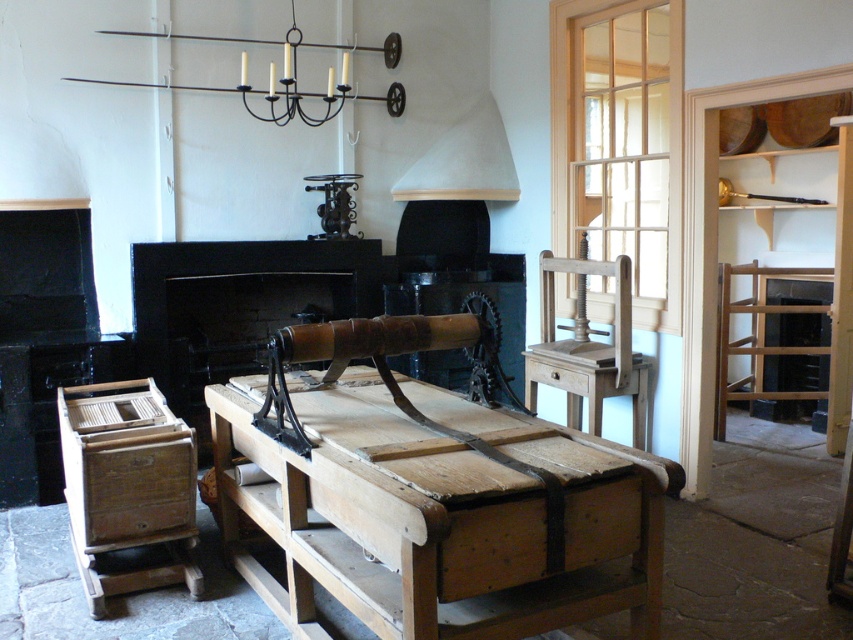
Between point (256, 253) and point (393, 58), which one is positioned in front?

Point (256, 253) is more forward.

Does black matte fireplace at center have a larger size compared to black metal chandelier at upper center?

Indeed, black matte fireplace at center has a larger size compared to black metal chandelier at upper center.

Between point (142, 348) and point (172, 88), which one is positioned in front?

Point (142, 348)

Find the location of a particular element. black matte fireplace at center is located at coordinates (236, 307).

Can you confirm if wooden table at center is positioned to the right of black metal chandelier at upper center?

Yes, wooden table at center is to the right of black metal chandelier at upper center.

Consider the image. Is wooden table at center thinner than black metal chandelier at upper center?

Indeed, wooden table at center has a lesser width compared to black metal chandelier at upper center.

Is point (625, 604) positioned in front of point (392, 109)?

Yes, it is.

Locate an element on the screen. This screenshot has width=853, height=640. wooden table at center is located at coordinates (438, 515).

Between wooden table at center and black matte fireplace at center, which one has less height?

With less height is wooden table at center.

Is wooden table at center shorter than black matte fireplace at center?

Correct, wooden table at center is not as tall as black matte fireplace at center.

This screenshot has height=640, width=853. I want to click on wooden table at center, so click(x=438, y=515).